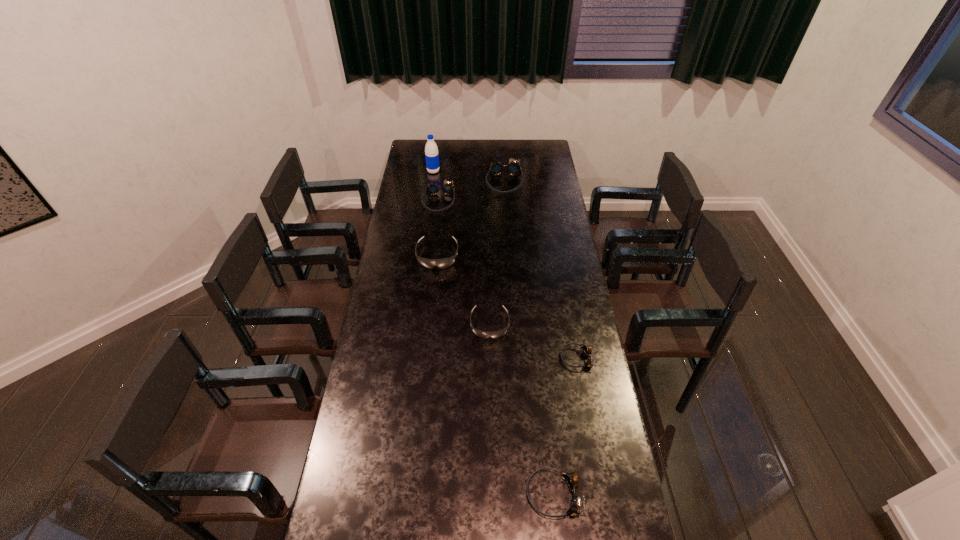
Identify the location of the smaller black goggles. The width and height of the screenshot is (960, 540). (482, 334).

This screenshot has width=960, height=540. I want to click on the smallest bronze goggles, so click(586, 349).

I want to click on the sixth farthest object, so click(586, 349).

Locate an element on the screen. The image size is (960, 540). vacant space located 0.080m on the left of the tallest object is located at coordinates (413, 171).

Where is `vacant region located through the lenses of the tallest goggles`? This screenshot has width=960, height=540. vacant region located through the lenses of the tallest goggles is located at coordinates (508, 244).

Find the location of `vacant region located through the lenses of the third smallest bronze goggles`. vacant region located through the lenses of the third smallest bronze goggles is located at coordinates (435, 238).

Locate an element on the screen. The height and width of the screenshot is (540, 960). free space located 0.060m on the lenses of the farther black goggles is located at coordinates tap(435, 281).

The width and height of the screenshot is (960, 540). Find the location of `free location located through the lenses of the nearest goggles`. free location located through the lenses of the nearest goggles is located at coordinates (491, 494).

Locate an element on the screen. free space located through the lenses of the nearest goggles is located at coordinates (427, 494).

Locate an element on the screen. The image size is (960, 540). vacant position located through the lenses of the nearest goggles is located at coordinates (467, 494).